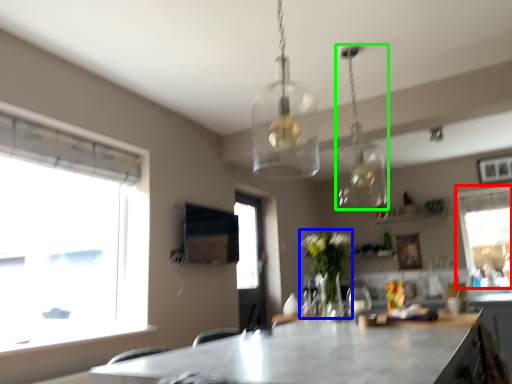
Question: Which object is the farthest from window (highlighted by a red box)? Choose among these: plant (highlighted by a blue box) or lamp (highlighted by a green box).

Choices:
 (A) plant
 (B) lamp

Answer: (A)